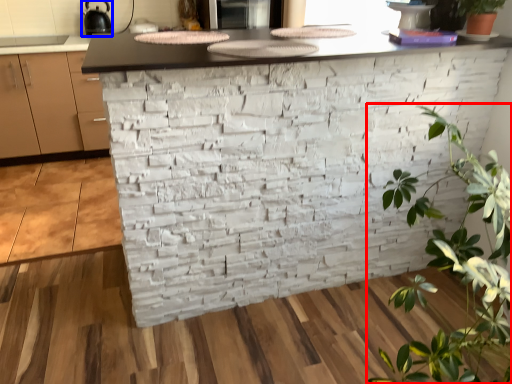
Question: Which object is further to the camera taking this photo, houseplant (highlighted by a red box) or appliance (highlighted by a blue box)?

Choices:
 (A) houseplant
 (B) appliance

Answer: (B)